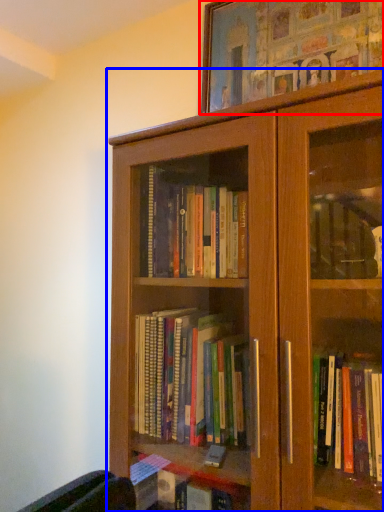
Question: Which object appears closest to the camera in this image, picture frame (highlighted by a red box) or bookcase (highlighted by a blue box)?

Choices:
 (A) picture frame
 (B) bookcase

Answer: (B)